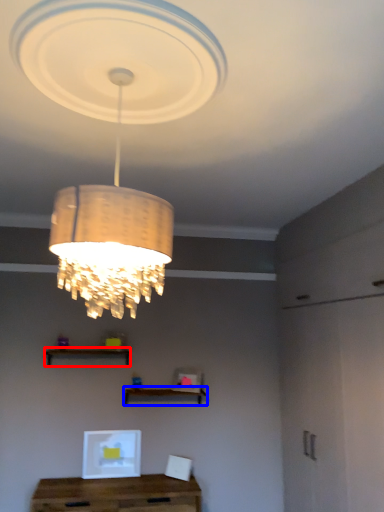
Question: Among these objects, which one is farthest to the camera, shelf (highlighted by a red box) or shelf (highlighted by a blue box)?

Choices:
 (A) shelf
 (B) shelf

Answer: (B)